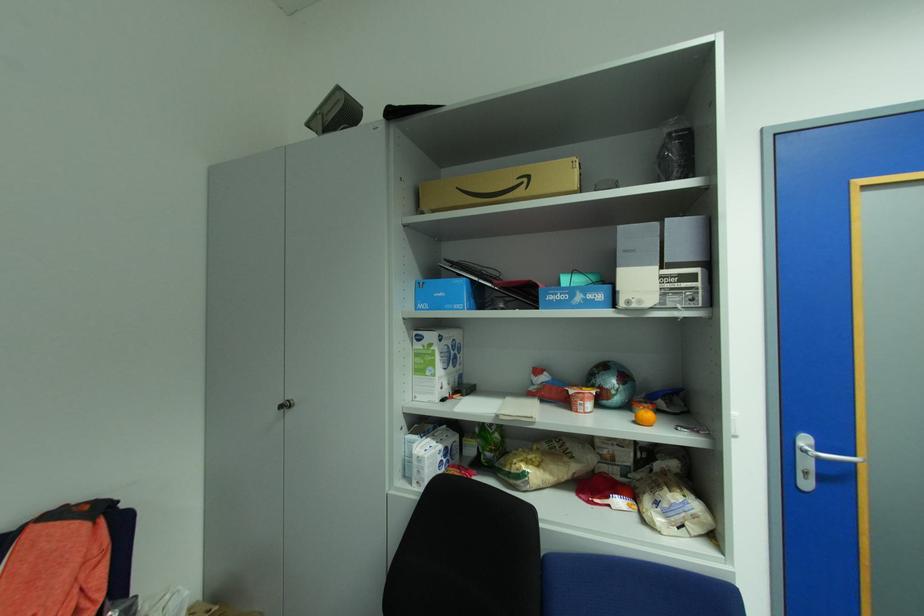
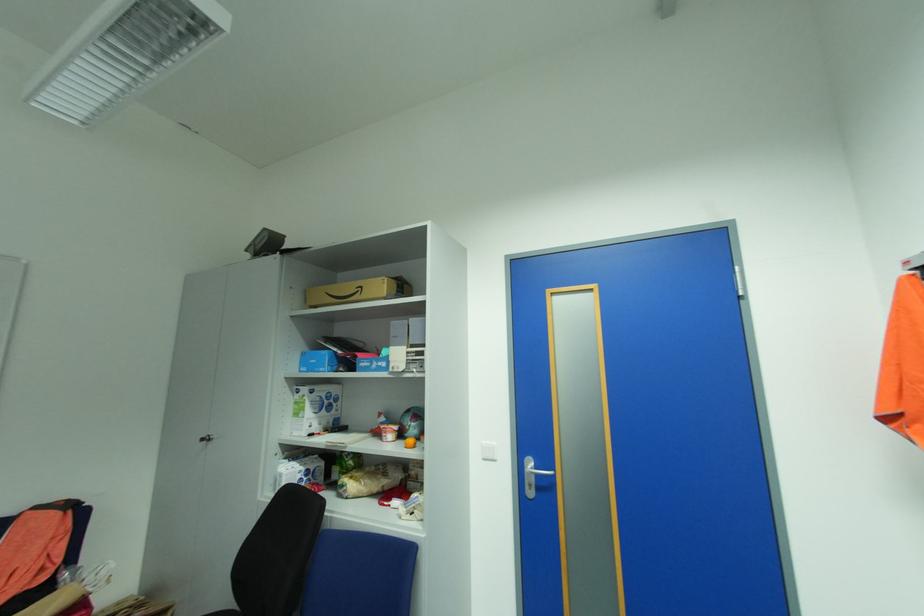
The point at (x=578, y=391) is marked in the first image. Where is the corresponding point in the second image?

(388, 427)